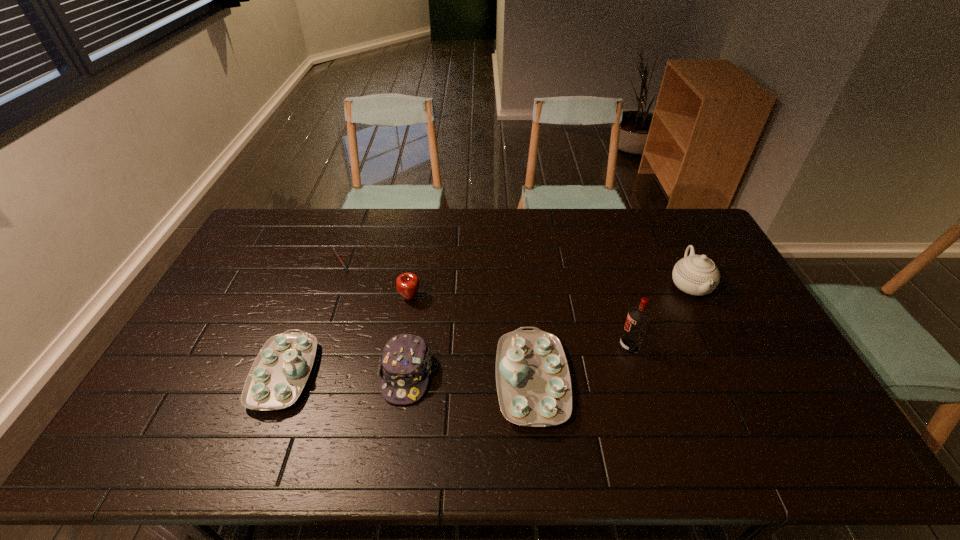
Considering the uniform spacing of chinawares, where should an additional chinaware be positioned on the right? Please locate a free spot. Please provide its 2D coordinates. Your answer should be formatted as a tuple, i.e. [(x, y)], where the tuple contains the x and y coordinates of a point satisfying the conditions above.

[(786, 388)]